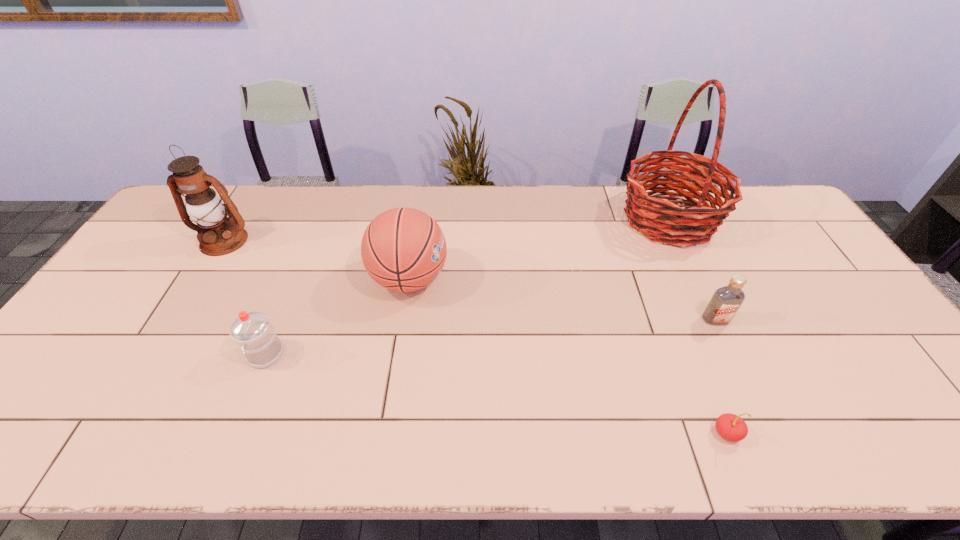
The image size is (960, 540). Identify the location of vacant space located on the left of the tallest object. (511, 219).

At what (x,y) coordinates should I click in order to perform the action: click on vacant space situated on the side of the leftmost object, there is a wick adjustment knob. Please return your answer as a coordinate pair (x, y). The width and height of the screenshot is (960, 540). Looking at the image, I should click on (204, 275).

Image resolution: width=960 pixels, height=540 pixels. In order to click on free point located 0.140m on the logo side of the third object from left to right in this screenshot , I will do `click(496, 279)`.

At what (x,y) coordinates should I click in order to perform the action: click on vacant space positioned 0.280m on the handle side of the fifth farthest object. Please return your answer as a coordinate pair (x, y). Looking at the image, I should click on (137, 354).

I want to click on vacant space located 0.080m on the handle side of the fifth farthest object, so click(216, 354).

Locate an element on the screen. The height and width of the screenshot is (540, 960). vacant position located 0.110m on the handle side of the fifth farthest object is located at coordinates (204, 354).

This screenshot has width=960, height=540. In order to click on vacant space located 0.180m on the front-facing side of the third nearest object in this screenshot , I will do `click(747, 386)`.

Image resolution: width=960 pixels, height=540 pixels. I want to click on free spot located 0.110m on the back of the nearest object, so click(705, 377).

Find the location of a particular element. The width and height of the screenshot is (960, 540). basket that is at the far edge is located at coordinates (646, 214).

At what (x,y) coordinates should I click in order to perform the action: click on lantern at the far edge. Please return your answer as a coordinate pair (x, y). The image size is (960, 540). Looking at the image, I should click on [218, 235].